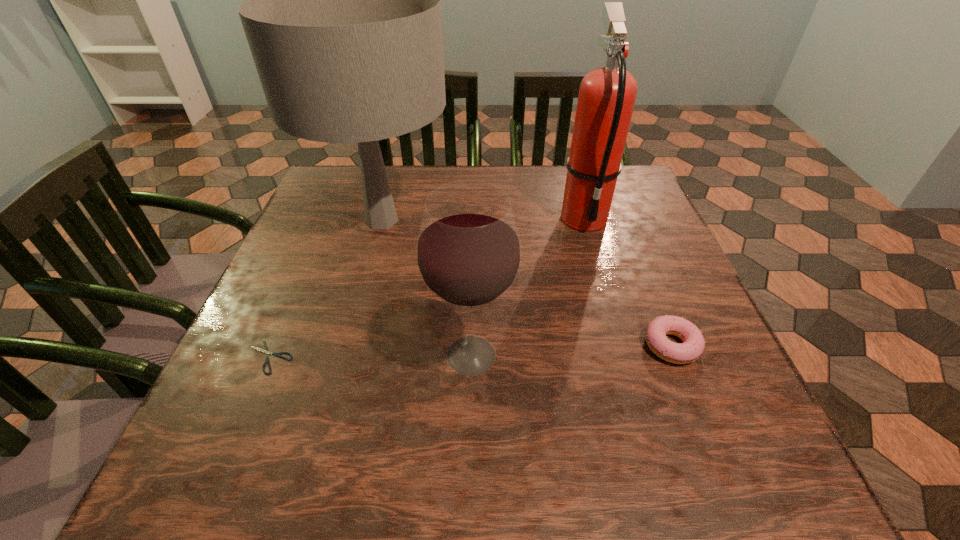
Locate an element on the screen. lampshade located at the far edge is located at coordinates (342, 13).

The image size is (960, 540). Identify the location of fire extinguisher that is at the far edge. (607, 94).

Find the location of `lampshade located in the left edge section of the desktop`. lampshade located in the left edge section of the desktop is located at coordinates (342, 13).

At what (x,y) coordinates should I click in order to perform the action: click on shears at the left edge. Please return your answer as a coordinate pair (x, y). This screenshot has height=540, width=960. Looking at the image, I should click on (265, 351).

Locate an element on the screen. The height and width of the screenshot is (540, 960). fire extinguisher located in the right edge section of the desktop is located at coordinates (607, 94).

This screenshot has height=540, width=960. Identify the location of doughnut that is at the right edge. (693, 345).

I want to click on object that is at the far left corner, so click(342, 13).

Find the location of a particular element. The width and height of the screenshot is (960, 540). object that is at the far right corner is located at coordinates (607, 94).

Where is `vacant position at the far edge of the desktop`? vacant position at the far edge of the desktop is located at coordinates (509, 189).

The image size is (960, 540). In the image, there is a desktop. In order to click on free space at the near edge in this screenshot , I will do `click(459, 487)`.